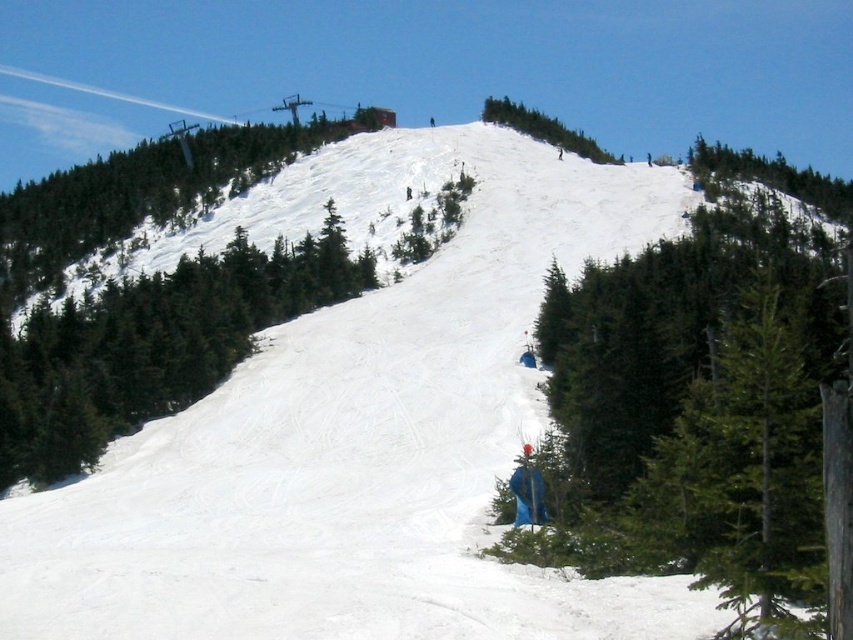
Does point (54, 476) lie in front of point (84, 211)?

That is True.

Can you confirm if green matte tree at center is wider than green textured tree at upper left?

No, green matte tree at center is not wider than green textured tree at upper left.

The width and height of the screenshot is (853, 640). Identify the location of green matte tree at center. (154, 346).

Does point (782, 504) lie behind point (593, 148)?

No.

Is green matte tree at lower right closer to camera compared to green textured tree at upper center?

Yes, green matte tree at lower right is in front of green textured tree at upper center.

Between point (677, 291) and point (534, 109), which one is positioned behind?

Point (534, 109)

What are the coordinates of `green matte tree at lower right` in the screenshot? It's located at (706, 413).

In the scene shown: Can you confirm if green matte tree at lower right is bigger than green matte tree at center?

Yes.

Who is higher up, green matte tree at lower right or green matte tree at center?

green matte tree at lower right is higher up.

Which is in front, point (560, 444) or point (234, 276)?

Point (560, 444) is more forward.

Identify the location of green matte tree at lower right. This screenshot has height=640, width=853. (706, 413).